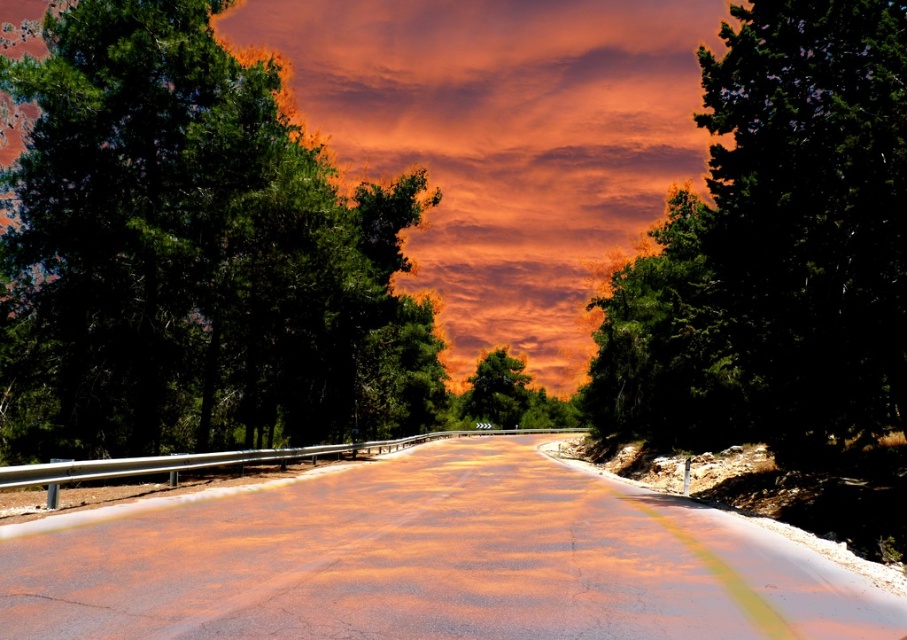
Question: Considering the real-world distances, which object is closest to the dark green textured tree at upper right?

Choices:
 (A) green matte tree at left
 (B) smooth asphalt road at center
 (C) green matte tree at center
 (D) orange cotton clouds at center

Answer: (B)

Question: Estimate the real-world distances between objects in this image. Which object is farther from the green matte tree at left?

Choices:
 (A) smooth asphalt road at center
 (B) orange cotton clouds at center

Answer: (B)

Question: Is smooth asphalt road at center bigger than dark green textured tree at upper right?

Choices:
 (A) yes
 (B) no

Answer: (B)

Question: Observing the image, what is the correct spatial positioning of smooth asphalt road at center in reference to green matte tree at center?

Choices:
 (A) left
 (B) right

Answer: (A)

Question: Which object is farther from the camera taking this photo?

Choices:
 (A) smooth asphalt road at center
 (B) green matte tree at center
 (C) dark green textured tree at upper right
 (D) green matte tree at left

Answer: (B)

Question: Does green matte tree at left appear on the left side of orange cotton clouds at center?

Choices:
 (A) yes
 (B) no

Answer: (A)